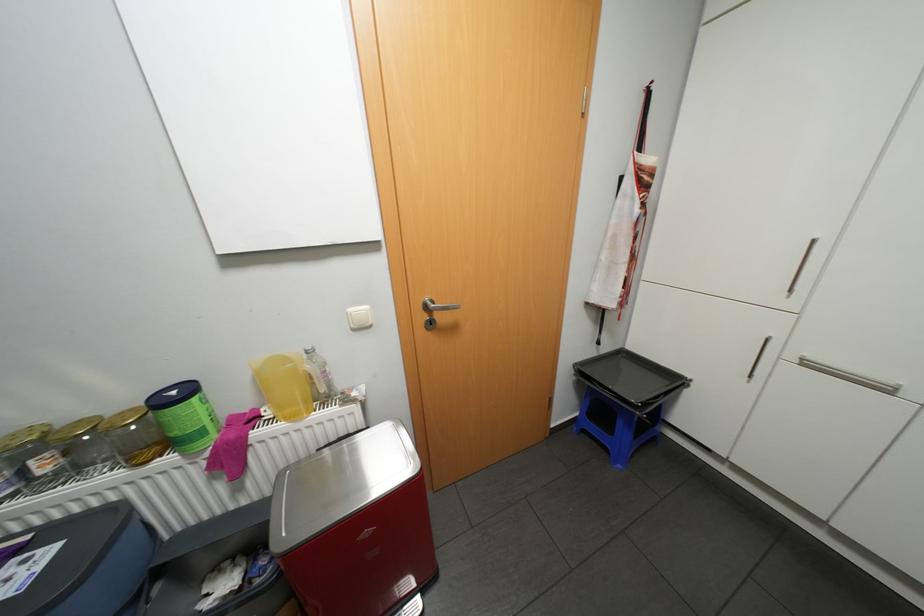
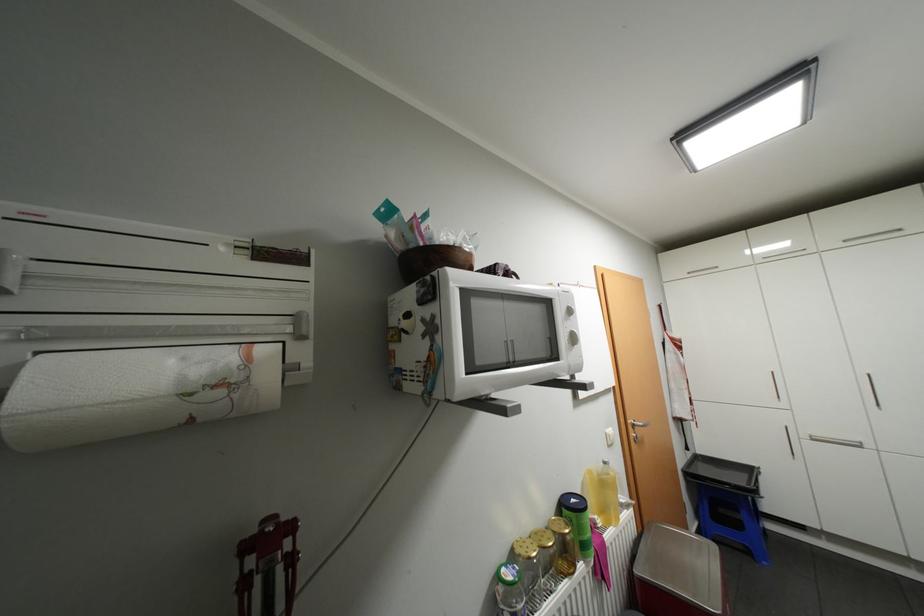
Find the pixel in the second image that matches (183,391) in the first image.

(580, 499)